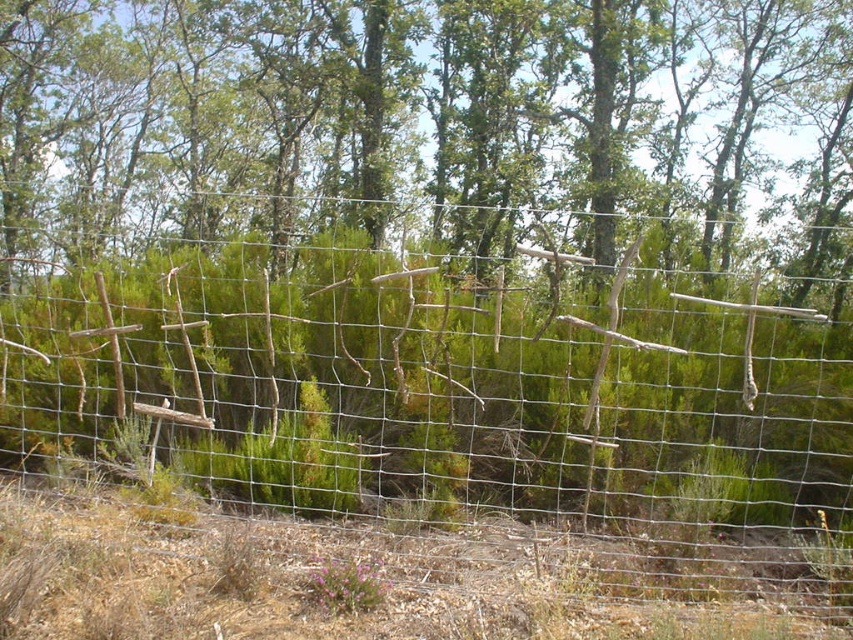
Based on the photo, between wire mesh fence at center and green leafy tree at center, which one appears on the left side from the viewer's perspective?

green leafy tree at center

Can you confirm if wire mesh fence at center is positioned to the left of green leafy tree at center?

Incorrect, wire mesh fence at center is not on the left side of green leafy tree at center.

Based on the photo, who is more distant from viewer, (695, 355) or (10, 92)?

The point (10, 92) is more distant.

Find the location of `wire mesh fence at center`. wire mesh fence at center is located at coordinates click(x=451, y=404).